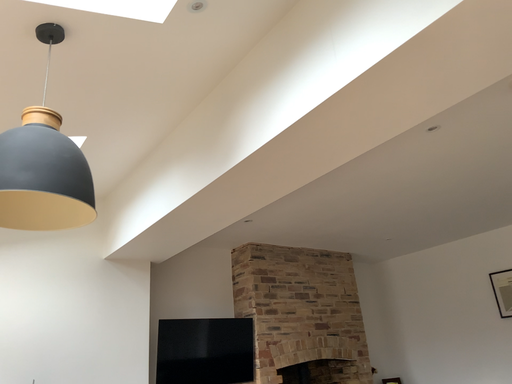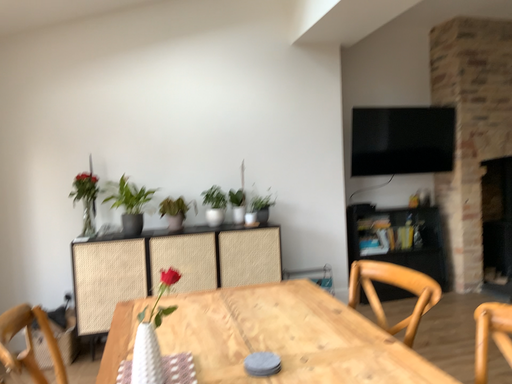
Question: Which way did the camera rotate in the video?

Choices:
 (A) rotated left
 (B) rotated right

Answer: (A)